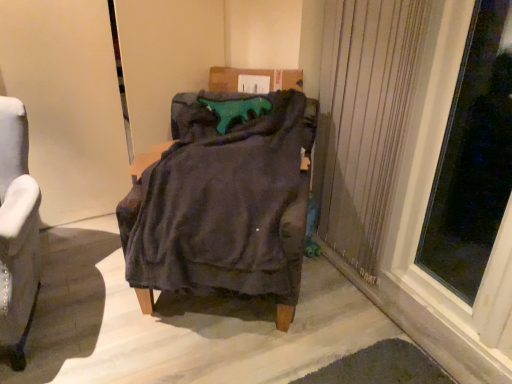
The image size is (512, 384). What do you see at coordinates (224, 200) in the screenshot?
I see `velvet dark gray armchair at center` at bounding box center [224, 200].

Locate an element on the screen. velvet gray armchair at left is located at coordinates (17, 232).

Identify the location of transparent glass window at right. The image size is (512, 384). (473, 157).

From a real-world perspective, is velvet gray armchair at left physically located above or below beige textured curtain at right?

velvet gray armchair at left is below beige textured curtain at right.

Considering the points (35, 186) and (408, 112), which point is behind, point (35, 186) or point (408, 112)?

The point (408, 112) is farther from the camera.

Which of these two, velvet gray armchair at left or beige textured curtain at right, is thinner?

beige textured curtain at right is thinner.

Considering their positions, is velvet gray armchair at left located in front of or behind beige textured curtain at right?

velvet gray armchair at left is positioned closer to the viewer than beige textured curtain at right.

From the picture: How different are the orientations of beige textured curtain at right and velvet gray armchair at left in degrees?

72.2 degrees.

From a real-world perspective, is beige textured curtain at right beneath velvet gray armchair at left?

No.

How distant is beige textured curtain at right from velvet gray armchair at left?

beige textured curtain at right and velvet gray armchair at left are 4.71 feet apart from each other.

Does beige textured curtain at right lie in front of velvet gray armchair at left?

No.

From a real-world perspective, is beige textured curtain at right positioned under transparent glass window at right based on gravity?

Yes, from a real-world perspective, beige textured curtain at right is under transparent glass window at right.

From the image's perspective, is beige textured curtain at right above or below transparent glass window at right?

beige textured curtain at right is situated higher than transparent glass window at right in the image.

The image size is (512, 384). Identify the location of window that appears on the right of beige textured curtain at right. (473, 157).

Does velvet dark gray armchair at center contain velvet gray armchair at left?

No, velvet gray armchair at left is not a part of velvet dark gray armchair at center.

Is velvet dark gray armchair at center bigger than velvet gray armchair at left?

Correct, velvet dark gray armchair at center is larger in size than velvet gray armchair at left.

Is velvet dark gray armchair at center positioned with its back to velvet gray armchair at left?

That's not correct — velvet dark gray armchair at center is not looking away from velvet gray armchair at left.

In the image, is velvet dark gray armchair at center positioned in front of or behind velvet gray armchair at left?

Visually, velvet dark gray armchair at center is located behind velvet gray armchair at left.

From the picture: Is velvet gray armchair at left oriented away from transparent glass window at right?

That's not correct — velvet gray armchair at left is not looking away from transparent glass window at right.

Which object is positioned more to the left, velvet gray armchair at left or transparent glass window at right?

velvet gray armchair at left.

From a real-world perspective, does velvet gray armchair at left stand above transparent glass window at right?

No, from a real-world perspective, velvet gray armchair at left is not above transparent glass window at right.

Is velvet gray armchair at left smaller than transparent glass window at right?

No.

Considering the positions of points (464, 74) and (151, 293), is point (464, 74) farther from camera compared to point (151, 293)?

No, it is in front of (151, 293).

Are transparent glass window at right and velvet dark gray armchair at center far apart?

That's not correct — transparent glass window at right is a little close to velvet dark gray armchair at center.

Between transparent glass window at right and velvet dark gray armchair at center, which one has larger size?

With larger size is velvet dark gray armchair at center.

Which object is wider, transparent glass window at right or velvet dark gray armchair at center?

With larger width is velvet dark gray armchair at center.

Looking at this image, is transparent glass window at right in front of or behind velvet gray armchair at left in the image?

transparent glass window at right is behind velvet gray armchair at left.

Is transparent glass window at right far from velvet gray armchair at left?

Yes, transparent glass window at right and velvet gray armchair at left are quite far apart.

How much distance is there between transparent glass window at right and velvet gray armchair at left?

transparent glass window at right is 2.01 meters away from velvet gray armchair at left.

Is transparent glass window at right positioned with its back to velvet gray armchair at left?

No, transparent glass window at right is not facing the opposite direction of velvet gray armchair at left.

The height and width of the screenshot is (384, 512). Find the location of `curtain above the velvet gray armchair at left (from the image's perspective)`. curtain above the velvet gray armchair at left (from the image's perspective) is located at coordinates (364, 119).

Locate an element on the screen. This screenshot has height=384, width=512. curtain positioned vertically above the velvet gray armchair at left (from a real-world perspective) is located at coordinates (364, 119).

Which object lies nearer to the anchor point beige textured curtain at right, velvet dark gray armchair at center or transparent glass window at right?

transparent glass window at right.

Estimate the real-world distances between objects in this image. Which object is closer to transparent glass window at right, velvet gray armchair at left or velvet dark gray armchair at center?

velvet dark gray armchair at center lies closer to transparent glass window at right than the other object.

From the image, which object appears to be nearer to velvet gray armchair at left, transparent glass window at right or velvet dark gray armchair at center?

velvet dark gray armchair at center is closer to velvet gray armchair at left.

When comparing their distances from velvet dark gray armchair at center, does beige textured curtain at right or velvet gray armchair at left seem closer?

beige textured curtain at right is closer to velvet dark gray armchair at center.

Considering their positions, is beige textured curtain at right positioned further to velvet dark gray armchair at center than transparent glass window at right?

The object further to velvet dark gray armchair at center is transparent glass window at right.

Estimate the real-world distances between objects in this image. Which object is further from beige textured curtain at right, velvet gray armchair at left or transparent glass window at right?

velvet gray armchair at left.

Based on their spatial positions, is velvet dark gray armchair at center or beige textured curtain at right closer to velvet gray armchair at left?

The object closer to velvet gray armchair at left is velvet dark gray armchair at center.

When comparing their distances from velvet dark gray armchair at center, does transparent glass window at right or beige textured curtain at right seem further?

transparent glass window at right lies further to velvet dark gray armchair at center than the other object.

At what (x,y) coordinates should I click in order to perform the action: click on curtain between velvet dark gray armchair at center and transparent glass window at right. Please return your answer as a coordinate pair (x, y). Looking at the image, I should click on (364, 119).

You are a GUI agent. You are given a task and a screenshot of the screen. Output one action in this format:
    pyautogui.click(x=<x>, y=<y>)
    Task: Click on the furniture between velvet gray armchair at left and beige textured curtain at right from left to right
    Image resolution: width=512 pixels, height=384 pixels.
    Given the screenshot: What is the action you would take?
    click(x=224, y=200)

Identify the location of curtain between velvet gray armchair at left and transparent glass window at right from left to right. (364, 119).

You are a GUI agent. You are given a task and a screenshot of the screen. Output one action in this format:
    pyautogui.click(x=<x>, y=<y>)
    Task: Click on the furniture between velvet gray armchair at left and transparent glass window at right in the horizontal direction
    
    Given the screenshot: What is the action you would take?
    pyautogui.click(x=224, y=200)